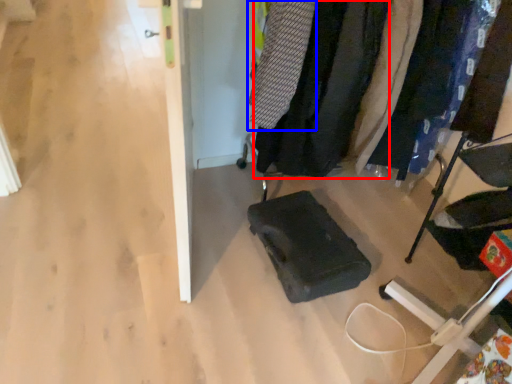
Question: Which point is further to the camera, clothing (highlighted by a red box) or clothing (highlighted by a blue box)?

Choices:
 (A) clothing
 (B) clothing

Answer: (A)